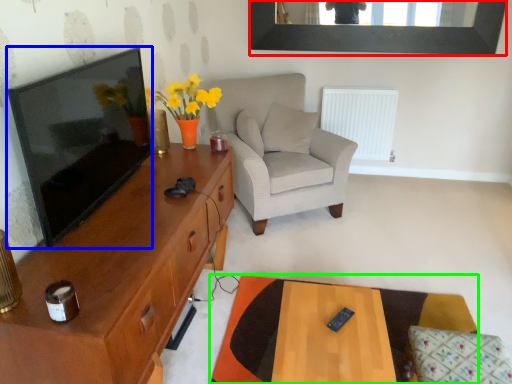
Question: Estimate the real-world distances between objects in this image. Which object is closer to picture frame (highlighted by a red box), television (highlighted by a blue box) or desk (highlighted by a green box)?

Choices:
 (A) television
 (B) desk

Answer: (A)